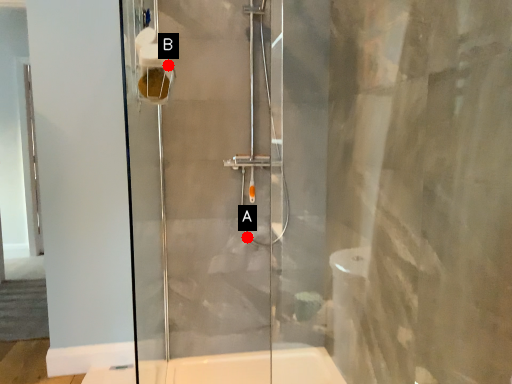
Question: Two points are circled on the image, labeled by A and B beside each circle. Which of the following is the farthest from the observer?

Choices:
 (A) A is further
 (B) B is further

Answer: (A)